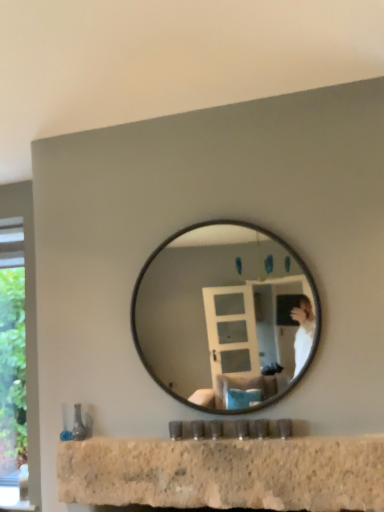
This screenshot has width=384, height=512. What are the coordinates of `empty space that is ontop of granite countertop at lower center (from a real-world perspective)` in the screenshot? It's located at (235, 434).